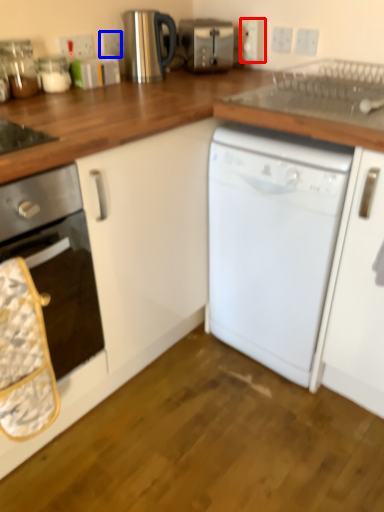
Question: Which object is further to the camera taking this photo, electric outlet (highlighted by a red box) or electric outlet (highlighted by a blue box)?

Choices:
 (A) electric outlet
 (B) electric outlet

Answer: (A)